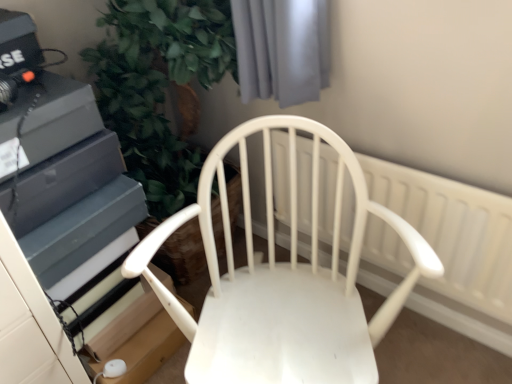
Question: Does white matte chair at center have a lesser height compared to white plastic radiator at center?

Choices:
 (A) no
 (B) yes

Answer: (A)

Question: Is white matte chair at center smaller than white plastic radiator at center?

Choices:
 (A) yes
 (B) no

Answer: (B)

Question: Is white matte chair at center outside white plastic radiator at center?

Choices:
 (A) no
 (B) yes

Answer: (B)

Question: Is white matte chair at center at the left side of white plastic radiator at center?

Choices:
 (A) yes
 (B) no

Answer: (A)

Question: Is white matte chair at center bigger than white plastic radiator at center?

Choices:
 (A) yes
 (B) no

Answer: (A)

Question: Considering the relative sizes of white matte chair at center and white plastic radiator at center in the image provided, is white matte chair at center taller than white plastic radiator at center?

Choices:
 (A) yes
 (B) no

Answer: (A)

Question: Can you confirm if white plastic radiator at center is thinner than white matte chair at center?

Choices:
 (A) yes
 (B) no

Answer: (A)

Question: From the image's perspective, is white plastic radiator at center located beneath white matte chair at center?

Choices:
 (A) no
 (B) yes

Answer: (A)

Question: Would you say white plastic radiator at center is outside white matte chair at center?

Choices:
 (A) no
 (B) yes

Answer: (B)

Question: Considering the relative sizes of white plastic radiator at center and white matte chair at center in the image provided, is white plastic radiator at center taller than white matte chair at center?

Choices:
 (A) yes
 (B) no

Answer: (B)

Question: Does white plastic radiator at center have a greater width compared to white matte chair at center?

Choices:
 (A) yes
 (B) no

Answer: (B)

Question: Is white plastic radiator at center facing away from white matte chair at center?

Choices:
 (A) yes
 (B) no

Answer: (A)

Question: From a real-world perspective, relative to white matte chair at center, is white plastic radiator at center vertically above or below?

Choices:
 (A) above
 (B) below

Answer: (B)